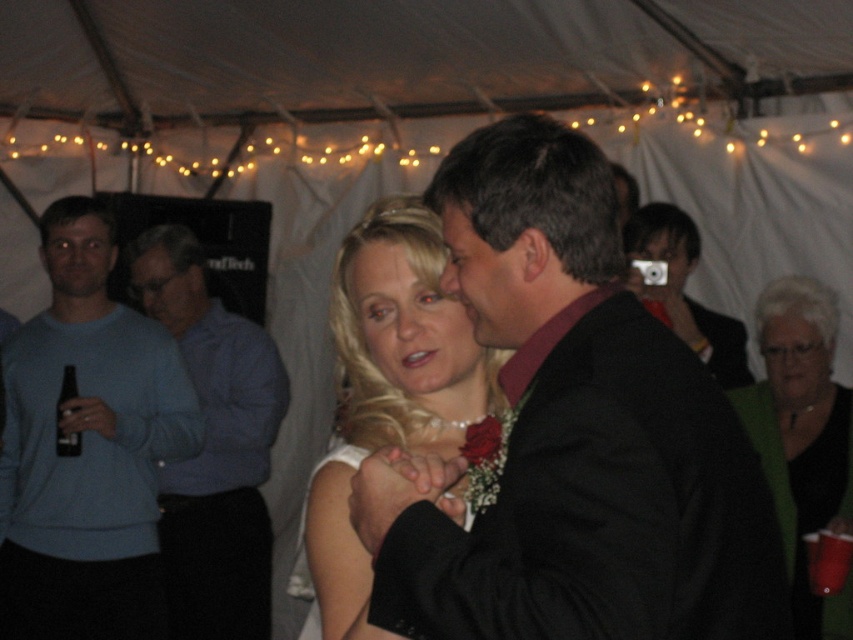
Question: Based on their relative distances, which object is farther from the blue sweater at left?

Choices:
 (A) matte blonde hair at center
 (B) black satin dress at lower right

Answer: (B)

Question: Does white satin dress at center have a larger size compared to blue shirt at left?

Choices:
 (A) yes
 (B) no

Answer: (B)

Question: Which object is closer to the camera taking this photo?

Choices:
 (A) matte blonde hair at center
 (B) black satin suit at center

Answer: (B)

Question: Does blue sweater at left have a smaller size compared to black satin dress at lower right?

Choices:
 (A) no
 (B) yes

Answer: (A)

Question: Can you confirm if blue sweater at left is positioned above matte blonde hair at center?

Choices:
 (A) yes
 (B) no

Answer: (B)

Question: Which of these objects is positioned closest to the matte blonde hair at center?

Choices:
 (A) matte black camera at upper right
 (B) blue shirt at left
 (C) white satin dress at center
 (D) black glass bottle at left

Answer: (C)